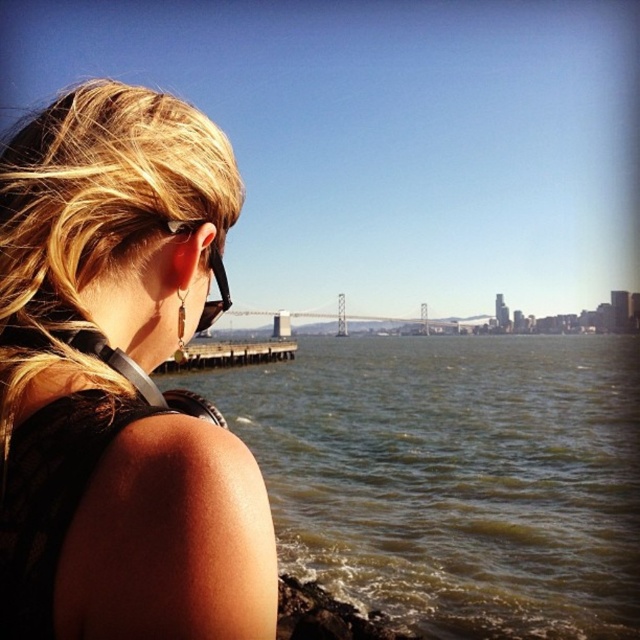
Question: Observing the image, what is the correct spatial positioning of blonde hair at upper left in reference to greenish water at lower left?

Choices:
 (A) below
 (B) above

Answer: (B)

Question: Is greenish water at lower left wider than black plastic goggles at upper left?

Choices:
 (A) no
 (B) yes

Answer: (B)

Question: Is greenish water at lower left below black plastic goggles at upper left?

Choices:
 (A) no
 (B) yes

Answer: (B)

Question: Among these points, which one is farthest from the camera?

Choices:
 (A) (476, 584)
 (B) (64, 320)

Answer: (A)

Question: Which object is the closest to the black plastic goggles at upper left?

Choices:
 (A) greenish water at lower left
 (B) blonde hair at upper left

Answer: (B)

Question: Which object is positioned farthest from the blonde hair at upper left?

Choices:
 (A) black plastic goggles at upper left
 (B) greenish water at lower left

Answer: (B)